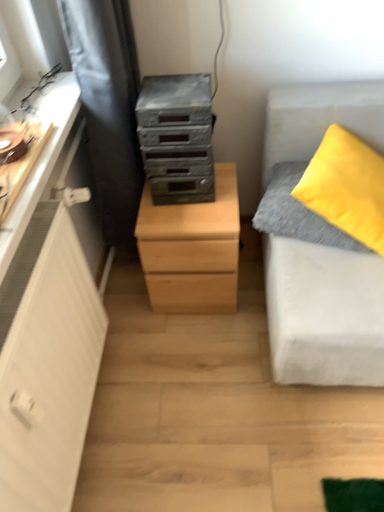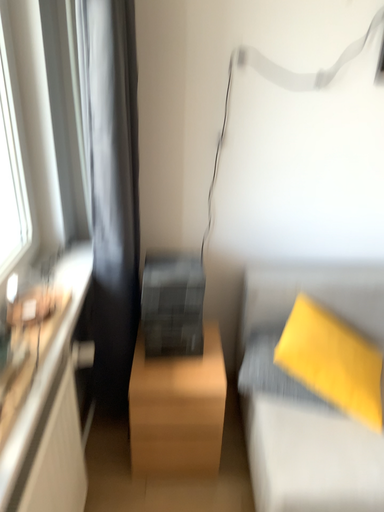
Question: Which way did the camera rotate in the video?

Choices:
 (A) rotated left
 (B) rotated right

Answer: (B)